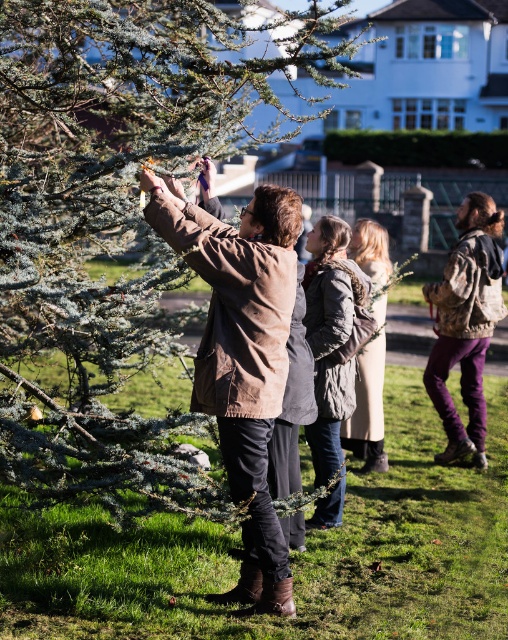
You are standing at the point labeled point (316, 433) and want to walk towards the point labeled point (367, 269). Based on the scene description, will you have to walk through any obstacles or people along the way?

Since point (316, 433) is in front of point (367, 269), you would be walking towards a position that is behind your current location. This means you would need to walk backward or reposition yourself to reach the desired point. There are no obstacles mentioned in the scene description besides the people, but since you are moving to a point behind you, you might not encounter anyone in front. However, the main decorator and others in the background could be in your path depending on their exact positions

You are standing in the middle of a park and see the green textured pine tree at center and the textured gray coat at center. Which object is closer to you?

Answer: The green textured pine tree at center is smaller than the textured gray coat at center, so the textured gray coat at center is closer to you.

You are a photographer standing in the same location as the person tying the ribbon. You want to take a photo that includes both the green textured pine tree at center and the knitted gray sweater at center. Which object will appear taller in the photo?

The knitted gray sweater at center will appear taller in the photo because the green textured pine tree at center is not as tall as knitted gray sweater at center.